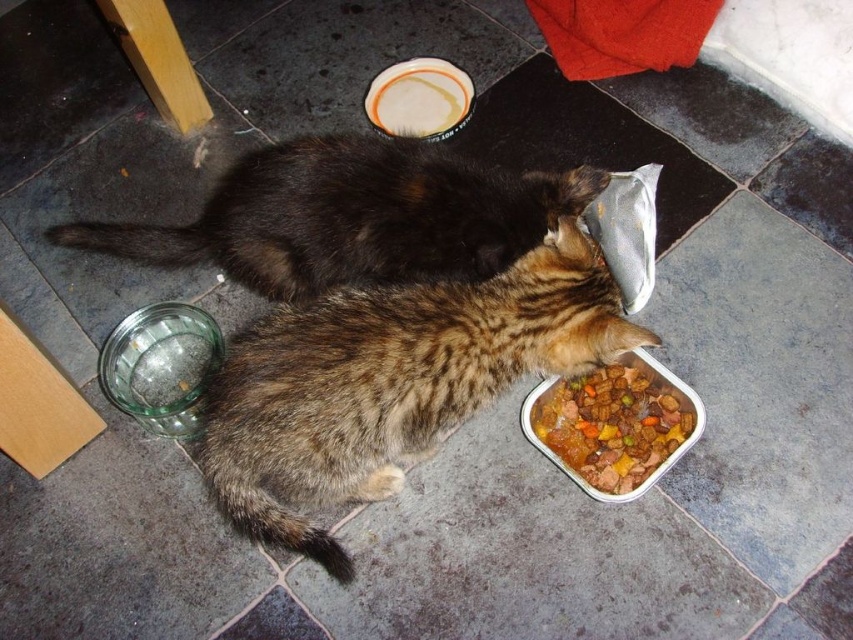
Is brown textured fur cat at lower center below dark brown fur cat at center?

Indeed, brown textured fur cat at lower center is positioned under dark brown fur cat at center.

Between brown textured fur cat at lower center and dark brown fur cat at center, which one appears on the left side from the viewer's perspective?

Positioned to the left is dark brown fur cat at center.

What do you see at coordinates (390, 381) in the screenshot? This screenshot has height=640, width=853. I see `brown textured fur cat at lower center` at bounding box center [390, 381].

Image resolution: width=853 pixels, height=640 pixels. In order to click on brown textured fur cat at lower center in this screenshot , I will do `click(390, 381)`.

Is dark brown fur cat at center to the left of white glossy plate at upper center from the viewer's perspective?

Yes, dark brown fur cat at center is to the left of white glossy plate at upper center.

Who is positioned more to the right, dark brown fur cat at center or white glossy plate at upper center?

From the viewer's perspective, white glossy plate at upper center appears more on the right side.

Between point (410, 266) and point (409, 90), which one is positioned behind?

Positioned behind is point (409, 90).

The image size is (853, 640). I want to click on dark brown fur cat at center, so click(351, 216).

Who is positioned more to the right, dark brown fur cat at center or meat and vegetable stew at lower center?

From the viewer's perspective, meat and vegetable stew at lower center appears more on the right side.

Is point (363, 228) closer to viewer compared to point (653, 412)?

Yes.

You are a GUI agent. You are given a task and a screenshot of the screen. Output one action in this format:
    pyautogui.click(x=<x>, y=<y>)
    Task: Click on the dark brown fur cat at center
    The height and width of the screenshot is (640, 853).
    Given the screenshot: What is the action you would take?
    pyautogui.click(x=351, y=216)